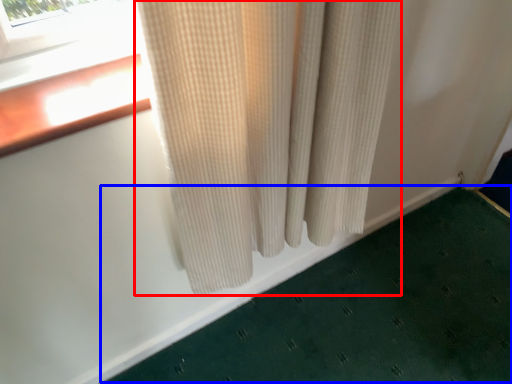
Question: Which object is further to the camera taking this photo, curtain (highlighted by a red box) or bath mat (highlighted by a blue box)?

Choices:
 (A) curtain
 (B) bath mat

Answer: (B)